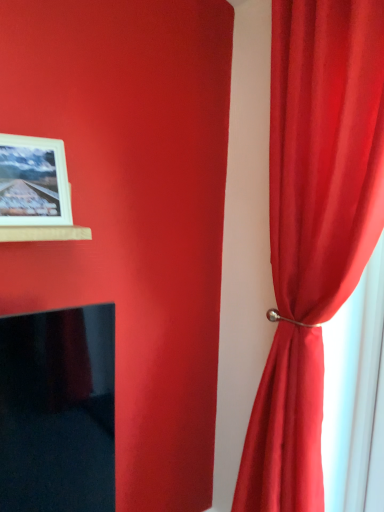
Question: Is satin red curtain at right to the right of white matte picture frame at upper left from the viewer's perspective?

Choices:
 (A) yes
 (B) no

Answer: (A)

Question: From the image's perspective, is satin red curtain at right located above white matte picture frame at upper left?

Choices:
 (A) yes
 (B) no

Answer: (B)

Question: Does satin red curtain at right have a smaller size compared to white matte picture frame at upper left?

Choices:
 (A) yes
 (B) no

Answer: (B)

Question: Is satin red curtain at right in contact with white matte picture frame at upper left?

Choices:
 (A) no
 (B) yes

Answer: (A)

Question: Can you confirm if satin red curtain at right is positioned to the left of white matte picture frame at upper left?

Choices:
 (A) yes
 (B) no

Answer: (B)

Question: Is satin red curtain at right bigger than white matte picture frame at upper left?

Choices:
 (A) no
 (B) yes

Answer: (B)

Question: From a real-world perspective, is white matte picture frame at upper left beneath satin red curtain at right?

Choices:
 (A) no
 (B) yes

Answer: (A)

Question: From the image's perspective, is white matte picture frame at upper left below satin red curtain at right?

Choices:
 (A) no
 (B) yes

Answer: (A)

Question: Considering the relative positions of white matte picture frame at upper left and satin red curtain at right in the image provided, is white matte picture frame at upper left to the left of satin red curtain at right from the viewer's perspective?

Choices:
 (A) no
 (B) yes

Answer: (B)

Question: Is white matte picture frame at upper left shorter than satin red curtain at right?

Choices:
 (A) no
 (B) yes

Answer: (B)

Question: Can you confirm if white matte picture frame at upper left is taller than satin red curtain at right?

Choices:
 (A) yes
 (B) no

Answer: (B)

Question: Does white matte picture frame at upper left have a larger size compared to satin red curtain at right?

Choices:
 (A) no
 (B) yes

Answer: (A)

Question: Would you say white matte picture frame at upper left is to the left or to the right of satin red curtain at right in the picture?

Choices:
 (A) left
 (B) right

Answer: (A)